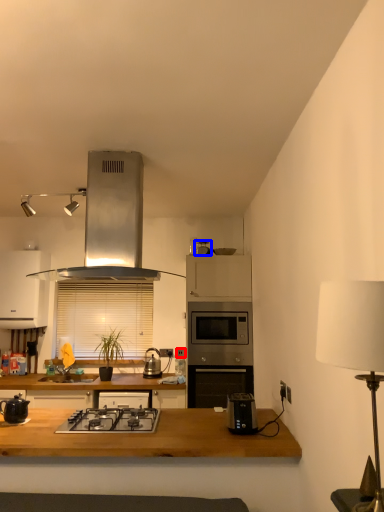
Question: Among these objects, which one is farthest to the camera, electric outlet (highlighted by a red box) or appliance (highlighted by a blue box)?

Choices:
 (A) electric outlet
 (B) appliance

Answer: (A)